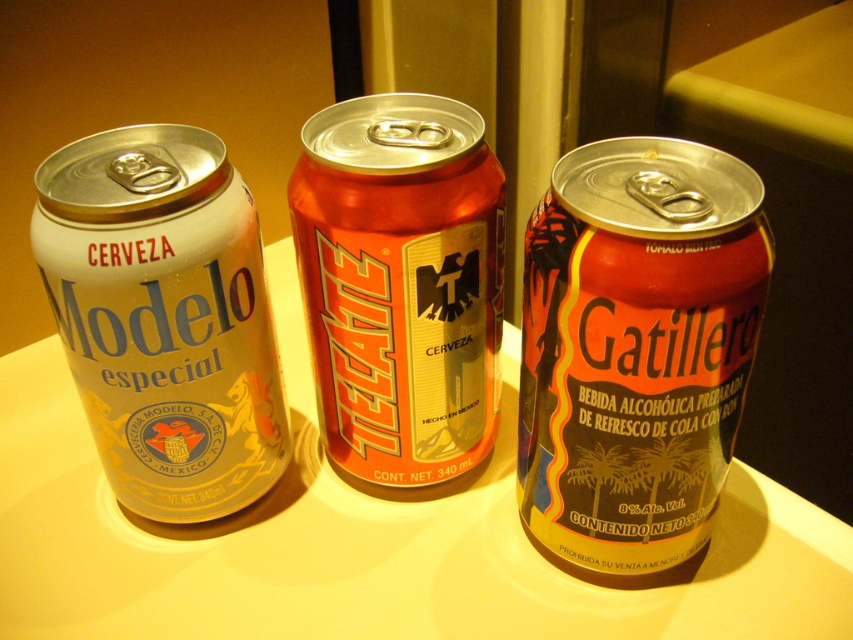
You have two cans on a table. The shiny metallic can at center and the silver metallic can at left. Which one has a bigger size?

The shiny metallic can at center is larger in size than the silver metallic can at left.

You are arranging cans on a shelf and need to place them in order from left to right. Given the shiny metallic can at center and the orange metallic can at center, which one should you place first on the left side of the shelf?

The orange metallic can at center should be placed first on the left side of the shelf because the shiny metallic can at center is to its right in the original arrangement.

You are looking at the scene and want to place a new object exactly at the center of the image. Is the shiny metallic can at center already occupying that spot?

The shiny metallic can at center is located at position point (636, 349), which is the center of the image. Therefore, the shiny metallic can at center is already occupying the center spot.